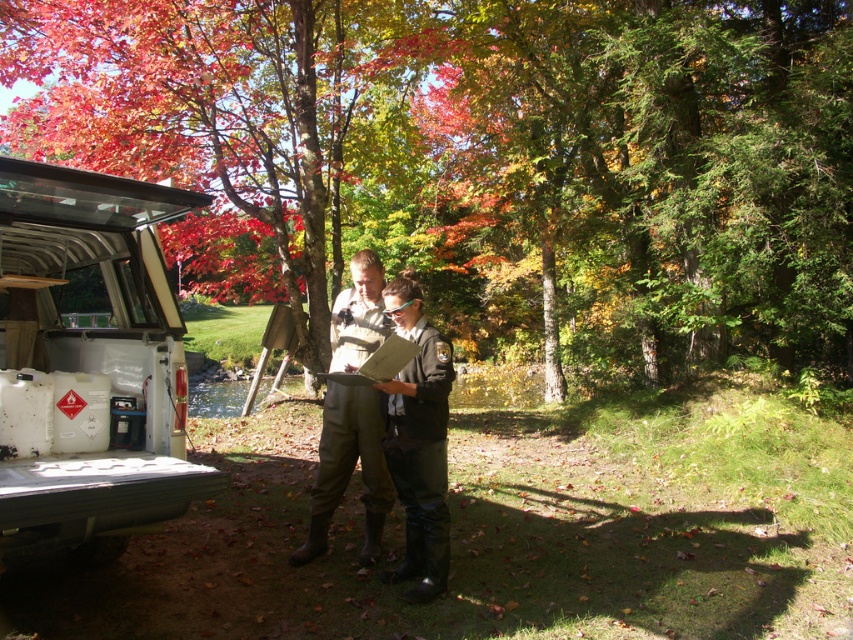
Is white plastic container at lower left to the left of black matte uniform at center from the viewer's perspective?

Yes, white plastic container at lower left is to the left of black matte uniform at center.

Is white plastic container at lower left positioned at the back of black matte uniform at center?

That is False.

Who is more forward, [51,499] or [387,422]?

Point [51,499]

I want to click on white plastic container at lower left, so click(x=90, y=364).

Which is behind, point (428, 500) or point (396, 336)?

Point (428, 500)

Can you confirm if dark brown leather boots at center is shorter than wooden clipboard at center?

Incorrect, dark brown leather boots at center's height does not fall short of wooden clipboard at center's.

What are the coordinates of `dark brown leather boots at center` in the screenshot? It's located at (392, 438).

Is point (379, 388) positioned after point (418, 328)?

No, (379, 388) is closer to viewer.

Can you confirm if dark brown leather boots at center is wider than black matte uniform at center?

Yes, dark brown leather boots at center is wider than black matte uniform at center.

This screenshot has height=640, width=853. Identify the location of dark brown leather boots at center. (392, 438).